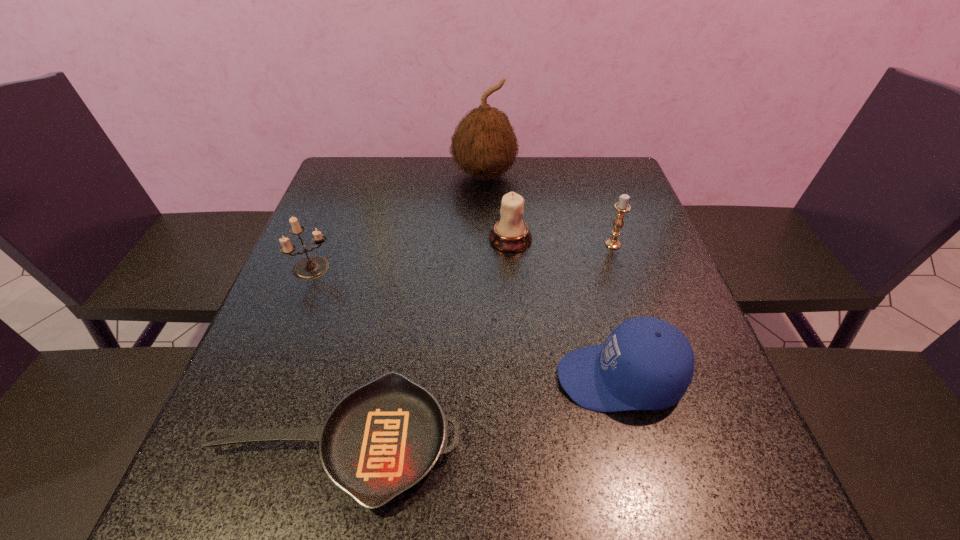
Locate an element on the screen. The width and height of the screenshot is (960, 540). the closest candle holder to the second candle holder from right to left is located at coordinates (622, 207).

Locate an element on the screen. The height and width of the screenshot is (540, 960). free space that satisfies the following two spatial constraints: 1. on the surface of the second candle holder from right to left; 2. on the left side of the coconut is located at coordinates (485, 239).

Identify the location of vacant space that satisfies the following two spatial constraints: 1. on the back side of the fourth farthest object; 2. on the right side of the rightmost candle holder. (324, 244).